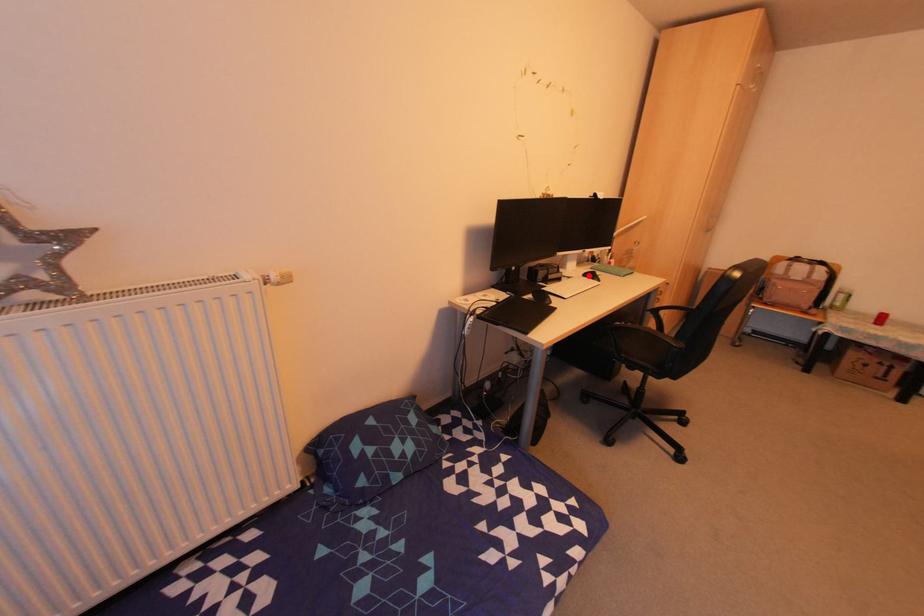
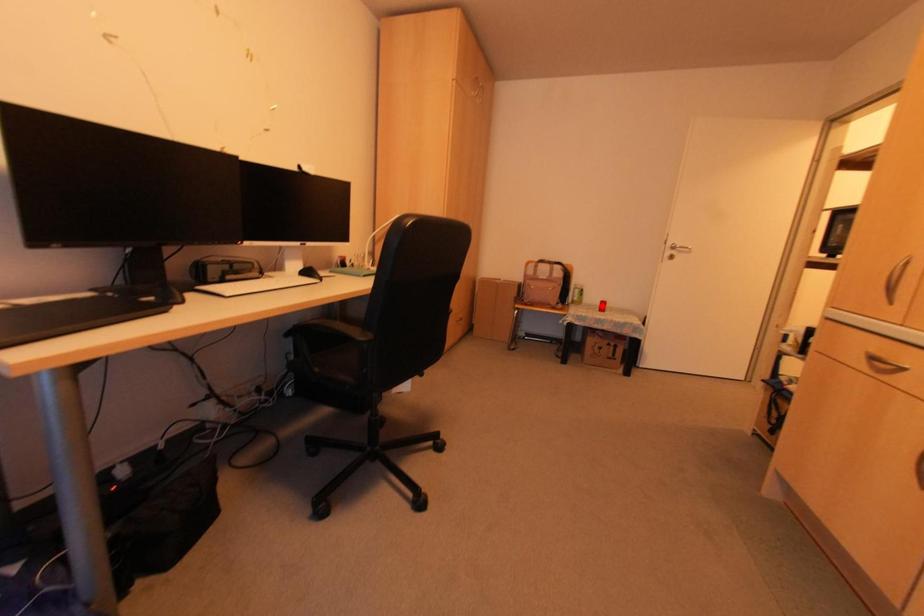
I am providing you with two images of the same scene from different viewpoints. A red point is marked on the first image and another point is marked on the second image. Are the points marked in image1 and image2 representing the same 3D position?

No